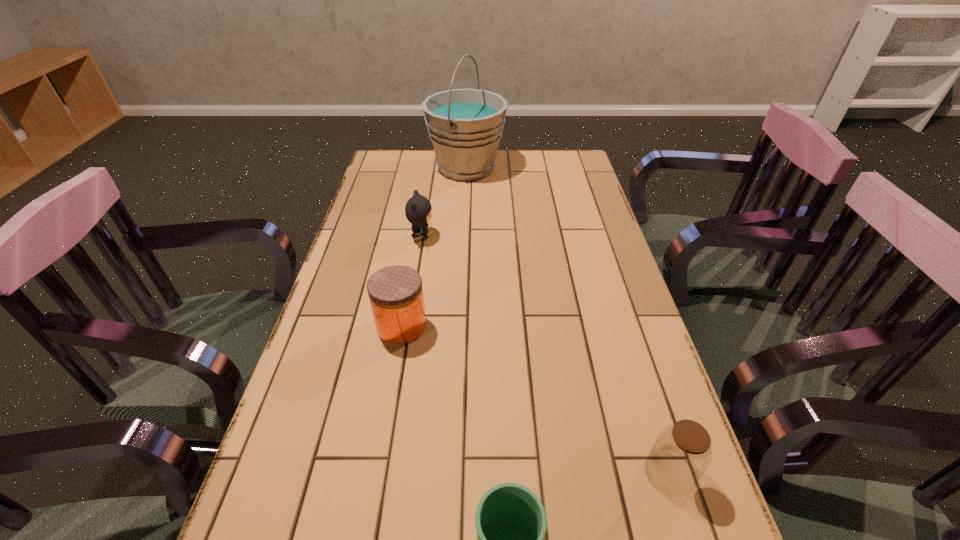
You are a GUI agent. You are given a task and a screenshot of the screen. Output one action in this format:
    pyautogui.click(x=<x>, y=<y>)
    Task: Click on the tallest object
    The height and width of the screenshot is (540, 960).
    Given the screenshot: What is the action you would take?
    pyautogui.click(x=465, y=126)

I want to click on the farthest object, so click(x=465, y=126).

Where is `the third nearest object`? The width and height of the screenshot is (960, 540). the third nearest object is located at coordinates 396,295.

Identify the location of the farther jar. The width and height of the screenshot is (960, 540). (396, 295).

The height and width of the screenshot is (540, 960). Identify the location of the second farthest object. (418, 210).

Where is `the fourth farthest object`? This screenshot has width=960, height=540. the fourth farthest object is located at coordinates (681, 454).

What are the coordinates of `the nearer jar` in the screenshot? It's located at (681, 454).

Identify the location of vacant space located 0.310m on the right of the farther jar. pyautogui.click(x=554, y=326).

Image resolution: width=960 pixels, height=540 pixels. I want to click on vacant space positioned 0.260m on the front-facing side of the second farthest object, so click(519, 236).

The height and width of the screenshot is (540, 960). I want to click on free space located on the left of the right jar, so click(519, 474).